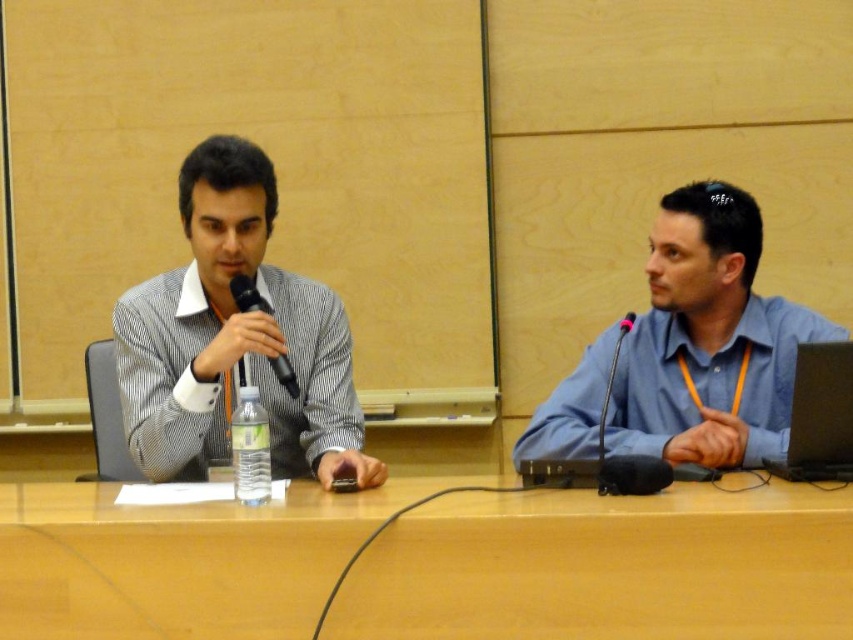
Can you confirm if striped fabric shirt at left is thinner than clear plastic bottle at center?

In fact, striped fabric shirt at left might be wider than clear plastic bottle at center.

Who is higher up, striped fabric shirt at left or clear plastic bottle at center?

striped fabric shirt at left is higher up.

Between point (260, 234) and point (259, 499), which one is positioned in front?

Positioned in front is point (259, 499).

You are a GUI agent. You are given a task and a screenshot of the screen. Output one action in this format:
    pyautogui.click(x=<x>, y=<y>)
    Task: Click on the striped fabric shirt at left
    This screenshot has height=640, width=853.
    Given the screenshot: What is the action you would take?
    pyautogui.click(x=234, y=339)

Is black glossy laptop at right further to camera compared to clear plastic bottle at center?

That is True.

Does black glossy laptop at right have a greater height compared to clear plastic bottle at center?

Correct, black glossy laptop at right is much taller as clear plastic bottle at center.

Does point (799, 348) come in front of point (234, 426)?

No, it is behind (234, 426).

You are a GUI agent. You are given a task and a screenshot of the screen. Output one action in this format:
    pyautogui.click(x=<x>, y=<y>)
    Task: Click on the black glossy laptop at right
    The height and width of the screenshot is (640, 853).
    Given the screenshot: What is the action you would take?
    pyautogui.click(x=819, y=416)

In the scene shown: Is wooden at center thinner than clear plastic bottle at center?

No, wooden at center is not thinner than clear plastic bottle at center.

Between point (440, 540) and point (241, 470), which one is positioned in front?

Point (440, 540) is in front.

Does point (123, 580) lie in front of point (244, 476)?

That is True.

Locate an element on the screen. wooden at center is located at coordinates (608, 566).